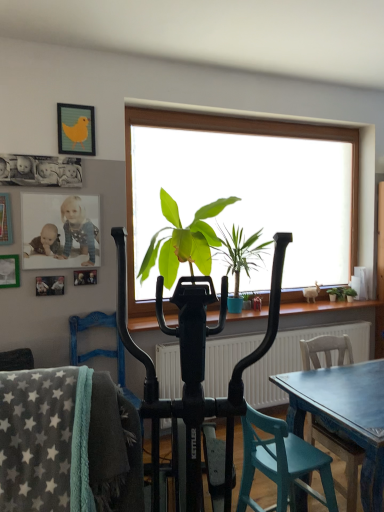
Question: Does matte plastic photo frame at upper left, which ranks as the second picture frame in bottom-to-top order, appear on the left side of wooden chair at lower right, which is the 1th chair from back to front?

Choices:
 (A) no
 (B) yes

Answer: (B)

Question: Considering the relative sizes of matte plastic photo frame at upper left, the 3th picture frame when ordered from top to bottom, and wooden chair at lower right, which ranks as the 3th chair in front-to-back order, in the image provided, is matte plastic photo frame at upper left, the 3th picture frame when ordered from top to bottom, wider than wooden chair at lower right, which ranks as the 3th chair in front-to-back order,?

Choices:
 (A) yes
 (B) no

Answer: (B)

Question: Is matte plastic photo frame at upper left, which ranks as the second picture frame in bottom-to-top order, not within wooden chair at lower right, the first chair in the right-to-left sequence?

Choices:
 (A) yes
 (B) no

Answer: (A)

Question: Is wooden chair at lower right, which is the 1th chair from back to front, surrounded by matte plastic photo frame at upper left, which ranks as the second picture frame in bottom-to-top order?

Choices:
 (A) yes
 (B) no

Answer: (B)

Question: From the image's perspective, would you say matte plastic photo frame at upper left, the 3th picture frame when ordered from top to bottom, is shown under wooden chair at lower right, which is the 1th chair from back to front?

Choices:
 (A) no
 (B) yes

Answer: (A)

Question: Looking at the image, does green leafy plant at right, which is counted as the 3th houseplant, starting from the left, seem bigger or smaller compared to gray fleece blanket at lower left, which is the 3th chair from right to left?

Choices:
 (A) small
 (B) big

Answer: (A)

Question: Does point (349, 295) appear closer or farther from the camera than point (56, 505)?

Choices:
 (A) closer
 (B) farther

Answer: (B)

Question: Considering the positions of green leafy plant at right, which is counted as the 3th houseplant, starting from the left, and gray fleece blanket at lower left, placed as the 3th chair when sorted from back to front, in the image, is green leafy plant at right, which is counted as the 3th houseplant, starting from the left, wider or thinner than gray fleece blanket at lower left, placed as the 3th chair when sorted from back to front,?

Choices:
 (A) wide
 (B) thin

Answer: (B)

Question: Considering their positions, is green leafy plant at right, the 1th houseplant from the right, located in front of or behind gray fleece blanket at lower left, placed as the 3th chair when sorted from back to front?

Choices:
 (A) front
 (B) behind

Answer: (B)

Question: From the image's perspective, is black plastic exercise bike at center located above or below green leafy plant at center, positioned as the 3th houseplant in right-to-left order?

Choices:
 (A) below
 (B) above

Answer: (A)

Question: Looking at their shapes, would you say black plastic exercise bike at center is wider or thinner than green leafy plant at center, positioned as the 3th houseplant in right-to-left order?

Choices:
 (A) thin
 (B) wide

Answer: (B)

Question: In terms of size, does black plastic exercise bike at center appear bigger or smaller than green leafy plant at center, positioned as the 3th houseplant in right-to-left order?

Choices:
 (A) big
 (B) small

Answer: (A)

Question: Considering their positions, is black plastic exercise bike at center located in front of or behind green leafy plant at center, positioned as the 3th houseplant in right-to-left order?

Choices:
 (A) behind
 (B) front

Answer: (B)

Question: Considering the relative positions of green leafy plant at right, which is counted as the 3th houseplant, starting from the left, and matte green picture frame at upper left, which is counted as the 4th picture frame, starting from the top, in the image provided, is green leafy plant at right, which is counted as the 3th houseplant, starting from the left, to the left or to the right of matte green picture frame at upper left, which is counted as the 4th picture frame, starting from the top,?

Choices:
 (A) left
 (B) right

Answer: (B)

Question: From a real-world perspective, is green leafy plant at right, the 1th houseplant from the right, physically located above or below matte green picture frame at upper left, which is counted as the 4th picture frame, starting from the top?

Choices:
 (A) below
 (B) above

Answer: (A)